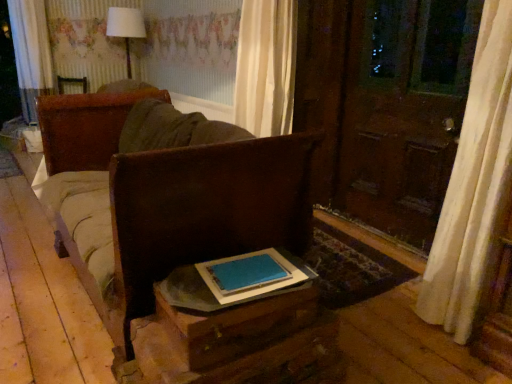
Question: Should I look upward or downward to see white fabric lampshade at upper center?

Choices:
 (A) down
 (B) up

Answer: (B)

Question: Is white fabric lampshade at upper center positioned with its back to wooden table at lower center?

Choices:
 (A) yes
 (B) no

Answer: (B)

Question: Is white fabric lampshade at upper center facing towards wooden table at lower center?

Choices:
 (A) no
 (B) yes

Answer: (A)

Question: Would you say white fabric lampshade at upper center is a long distance from wooden table at lower center?

Choices:
 (A) no
 (B) yes

Answer: (B)

Question: Does white fabric lampshade at upper center have a larger size compared to wooden table at lower center?

Choices:
 (A) yes
 (B) no

Answer: (A)

Question: From a real-world perspective, is white fabric lampshade at upper center located higher than wooden table at lower center?

Choices:
 (A) no
 (B) yes

Answer: (B)

Question: From the image's perspective, is white fabric lampshade at upper center on wooden table at lower center?

Choices:
 (A) yes
 (B) no

Answer: (A)

Question: Considering the relative sizes of blue matte book at center and brown leather couch at center in the image provided, is blue matte book at center taller than brown leather couch at center?

Choices:
 (A) no
 (B) yes

Answer: (A)

Question: From the image's perspective, is blue matte book at center located above brown leather couch at center?

Choices:
 (A) yes
 (B) no

Answer: (B)

Question: Does blue matte book at center have a greater width compared to brown leather couch at center?

Choices:
 (A) yes
 (B) no

Answer: (B)

Question: Is brown leather couch at center a part of blue matte book at center?

Choices:
 (A) no
 (B) yes

Answer: (A)

Question: Is blue matte book at center oriented away from brown leather couch at center?

Choices:
 (A) no
 (B) yes

Answer: (A)

Question: Does blue matte book at center have a lesser width compared to brown leather couch at center?

Choices:
 (A) yes
 (B) no

Answer: (A)

Question: Is blue matte book at center not near wooden table at lower center?

Choices:
 (A) no
 (B) yes

Answer: (A)